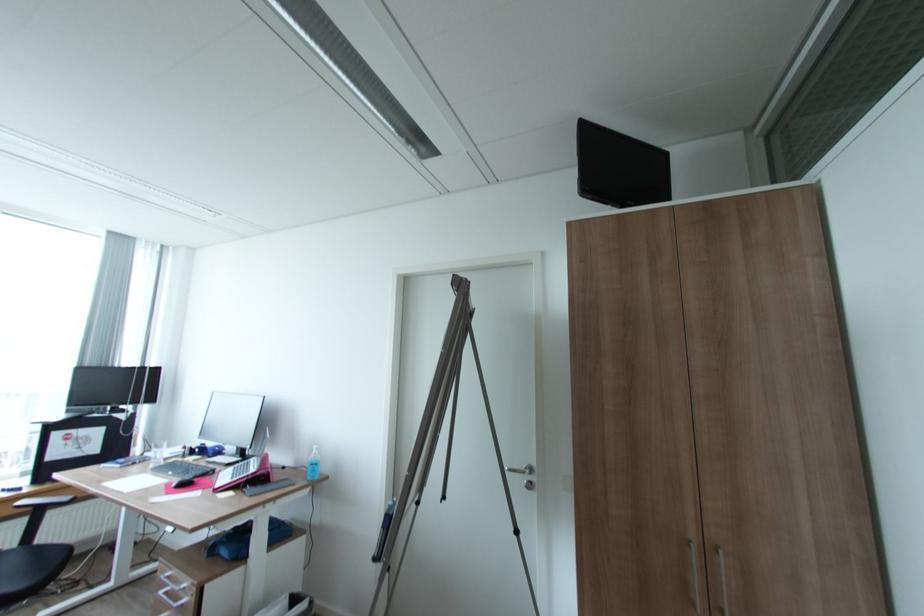
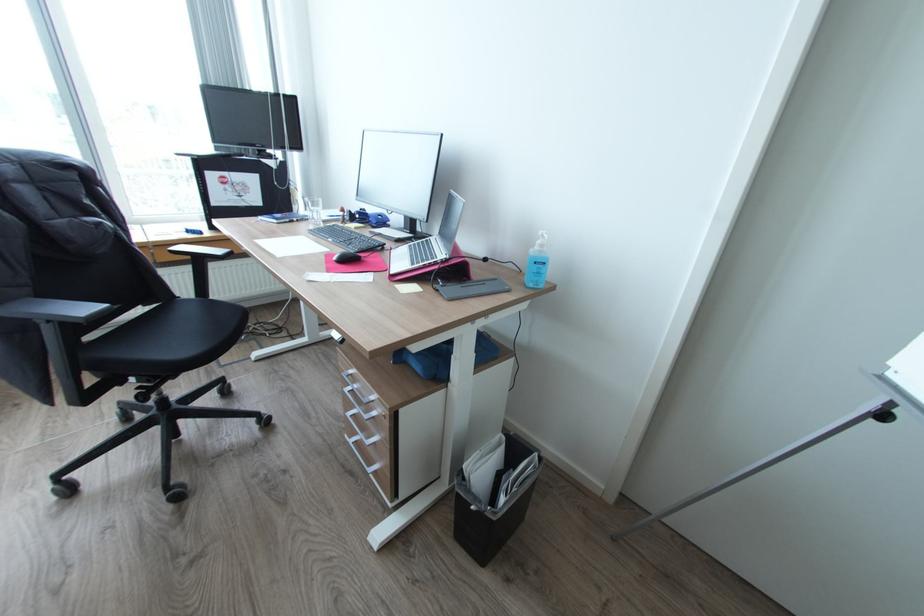
Where in the second image is the point corresponding to point 178,485 from the first image?

(339, 257)